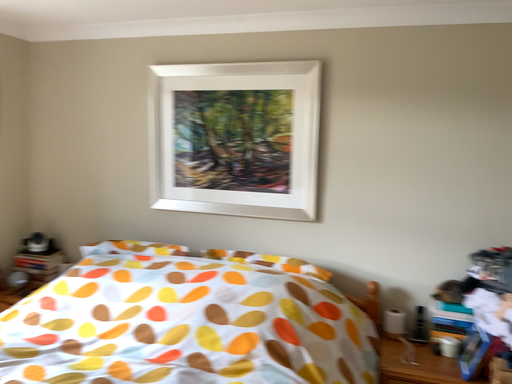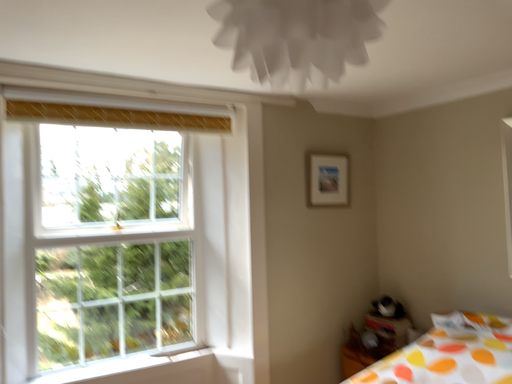
Question: How did the camera likely rotate when shooting the video?

Choices:
 (A) rotated right
 (B) rotated left

Answer: (B)